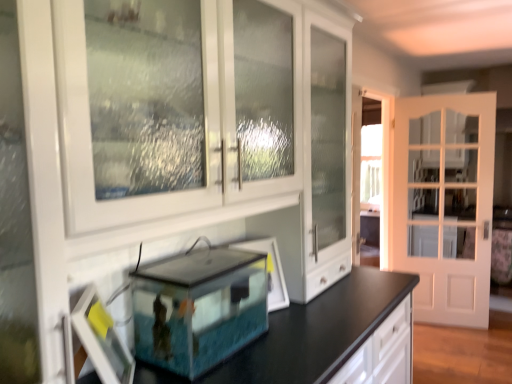
Question: Is clear glass picture frame at center, the 1th picture frame from the back, looking in the opposite direction of transparent glass tank at center?

Choices:
 (A) yes
 (B) no

Answer: (B)

Question: Considering the relative positions of clear glass picture frame at center, arranged as the second picture frame when viewed from the front, and transparent glass tank at center in the image provided, is clear glass picture frame at center, arranged as the second picture frame when viewed from the front, to the left of transparent glass tank at center from the viewer's perspective?

Choices:
 (A) no
 (B) yes

Answer: (A)

Question: Is clear glass picture frame at center, arranged as the second picture frame when viewed from the front, behind transparent glass tank at center?

Choices:
 (A) no
 (B) yes

Answer: (B)

Question: From the image's perspective, is clear glass picture frame at center, acting as the first picture frame starting from the right, on top of transparent glass tank at center?

Choices:
 (A) no
 (B) yes

Answer: (B)

Question: Is clear glass picture frame at center, positioned as the 2th picture frame in left-to-right order, positioned beyond the bounds of transparent glass tank at center?

Choices:
 (A) no
 (B) yes

Answer: (B)

Question: Could you tell me if clear glass picture frame at center, acting as the first picture frame starting from the right, is turned towards transparent glass tank at center?

Choices:
 (A) no
 (B) yes

Answer: (A)

Question: From the image's perspective, is transparent glass tank at center over matte white picture frame at lower left, the second picture frame in the back-to-front sequence?

Choices:
 (A) no
 (B) yes

Answer: (B)

Question: Can you confirm if transparent glass tank at center is positioned to the right of matte white picture frame at lower left, the second picture frame in the back-to-front sequence?

Choices:
 (A) no
 (B) yes

Answer: (B)

Question: Is matte white picture frame at lower left, the 1th picture frame viewed from the left, inside transparent glass tank at center?

Choices:
 (A) no
 (B) yes

Answer: (A)

Question: Considering the relative sizes of transparent glass tank at center and matte white picture frame at lower left, positioned as the 2th picture frame in right-to-left order, in the image provided, is transparent glass tank at center bigger than matte white picture frame at lower left, positioned as the 2th picture frame in right-to-left order,?

Choices:
 (A) no
 (B) yes

Answer: (B)

Question: Does transparent glass tank at center have a greater height compared to matte white picture frame at lower left, the 1th picture frame viewed from the left?

Choices:
 (A) yes
 (B) no

Answer: (B)

Question: Is transparent glass tank at center next to matte white picture frame at lower left, the 1th picture frame from the front?

Choices:
 (A) no
 (B) yes

Answer: (A)

Question: Is clear glass picture frame at center, acting as the first picture frame starting from the right, further to the viewer compared to white glossy cabinet at center?

Choices:
 (A) yes
 (B) no

Answer: (A)